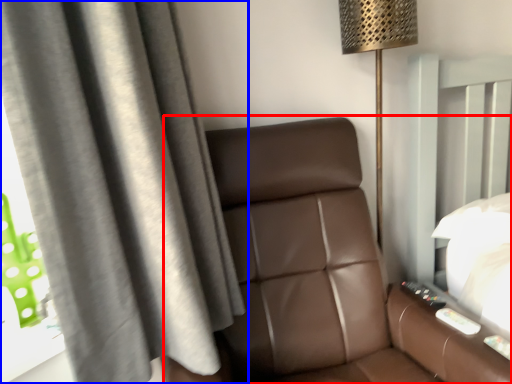
Question: Among these objects, which one is farthest to the camera, furniture (highlighted by a red box) or curtain (highlighted by a blue box)?

Choices:
 (A) furniture
 (B) curtain

Answer: (B)